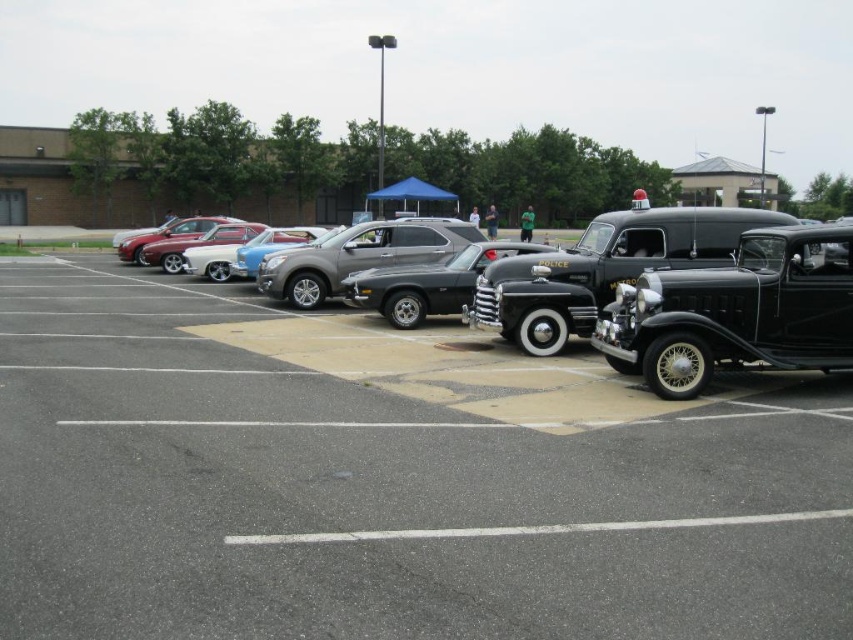
Question: Is shiny black police car at center positioned behind white asphalt line at lower center?

Choices:
 (A) yes
 (B) no

Answer: (A)

Question: Can you confirm if satin silver suv at center is positioned to the right of white asphalt line at lower center?

Choices:
 (A) yes
 (B) no

Answer: (B)

Question: Estimate the real-world distances between objects in this image. Which object is closer to the black polished car at center?

Choices:
 (A) satin silver suv at center
 (B) white asphalt line at lower center
 (C) shiny black car at right
 (D) shiny silver sedan at center

Answer: (C)

Question: Which point is closer to the camera?

Choices:
 (A) (686, 365)
 (B) (30, 346)
 (C) (321, 280)
 (D) (248, 536)

Answer: (D)

Question: Which is farther from the shiny black police car at center?

Choices:
 (A) satin silver suv at center
 (B) shiny silver sedan at center
 (C) shiny black car at center

Answer: (B)

Question: Can you confirm if shiny black car at right is bigger than white asphalt line at lower center?

Choices:
 (A) no
 (B) yes

Answer: (B)